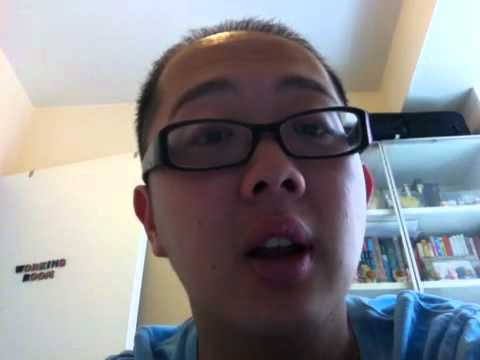
The image size is (480, 360). I want to click on door, so click(96, 313).